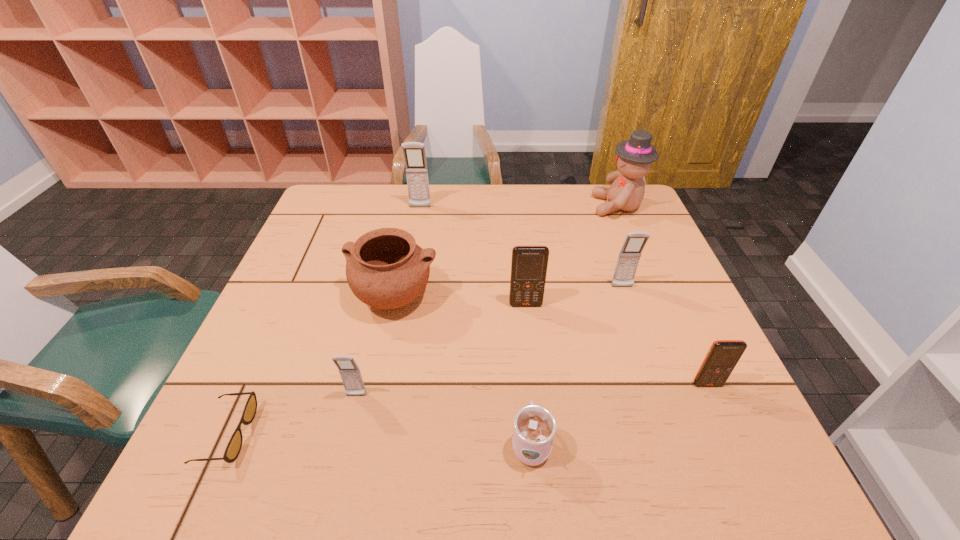
You are a GUI agent. You are given a task and a screenshot of the screen. Output one action in this format:
    pyautogui.click(x=<x>, y=<y>)
    Task: Click on the free spot between the leftmost object and the tallest cellular telephone
    This screenshot has width=960, height=540.
    Given the screenshot: What is the action you would take?
    pyautogui.click(x=324, y=321)

Where is `vacant space that is in between the terracotta pottery and the third nearest object`? The image size is (960, 540). vacant space that is in between the terracotta pottery and the third nearest object is located at coordinates (375, 347).

Identify the location of vacant point located between the bigger orange cellular telephone and the leftmost gray cellular telephone. point(441,350).

The height and width of the screenshot is (540, 960). In order to click on free spot between the fourth farthest cellular telephone and the second shortest object in this screenshot , I will do pyautogui.click(x=619, y=414).

This screenshot has width=960, height=540. Identify the location of vacant area that lies between the pottery and the shortest object. (311, 366).

The image size is (960, 540). I want to click on free space between the second shortest object and the smaller orange cellular telephone, so click(619, 414).

This screenshot has height=540, width=960. In order to click on vacant space in between the cup and the sunglasses in this screenshot , I will do `click(379, 439)`.

At what (x,y) coordinates should I click in order to perform the action: click on free area in between the biggest gray cellular telephone and the bigger orange cellular telephone. Please return your answer as a coordinate pair (x, y). Looking at the image, I should click on (473, 256).

Select which object appears as the closest to the bigger orange cellular telephone. Please provide its 2D coordinates. Your answer should be formatted as a tuple, i.e. [(x, y)], where the tuple contains the x and y coordinates of a point satisfying the conditions above.

[(385, 268)]

The height and width of the screenshot is (540, 960). I want to click on object that is the closest one to the rag_doll, so click(x=628, y=259).